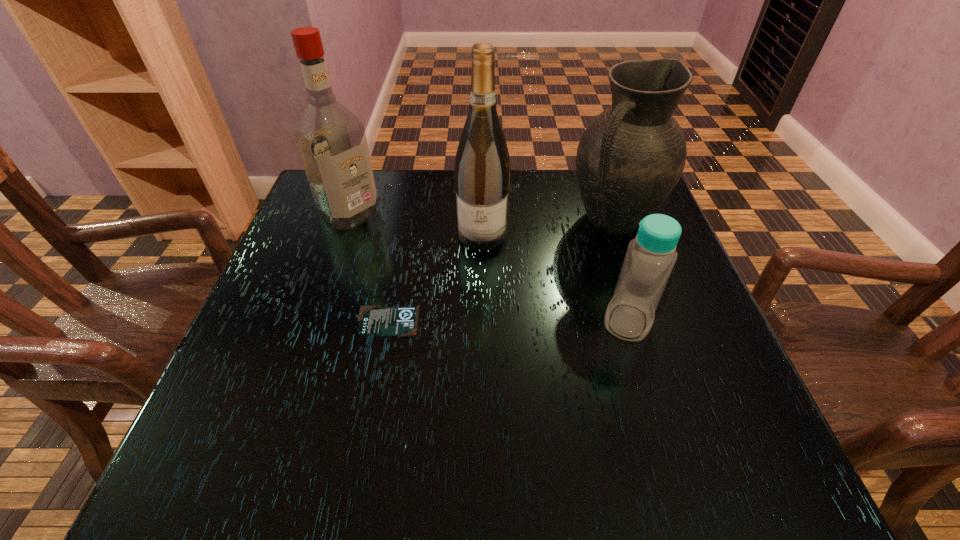
Where is `free spot on the desktop that is between the identity card and the second shortest object and is positioned on the side of the pitcher with the handle`? Image resolution: width=960 pixels, height=540 pixels. free spot on the desktop that is between the identity card and the second shortest object and is positioned on the side of the pitcher with the handle is located at coordinates (502, 321).

Where is `vacant space on the desktop that is between the identity card and the bottle and is positioned on the front-facing side of the liquor`? Image resolution: width=960 pixels, height=540 pixels. vacant space on the desktop that is between the identity card and the bottle and is positioned on the front-facing side of the liquor is located at coordinates (503, 321).

You are a GUI agent. You are given a task and a screenshot of the screen. Output one action in this format:
    pyautogui.click(x=<x>, y=<y>)
    Task: Click on the vacant space on the desktop that is between the identity card and the bottle and is positioned on the label of the third object from right to left
    
    Given the screenshot: What is the action you would take?
    pyautogui.click(x=474, y=321)